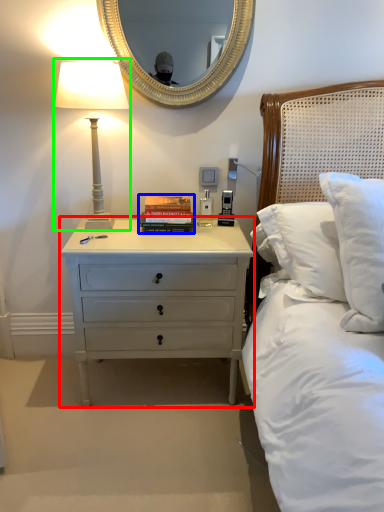
Question: Estimate the real-world distances between objects in this image. Which object is closer to nightstand (highlighted by a red box), paperback book (highlighted by a blue box) or bedside lamp (highlighted by a green box)?

Choices:
 (A) paperback book
 (B) bedside lamp

Answer: (A)